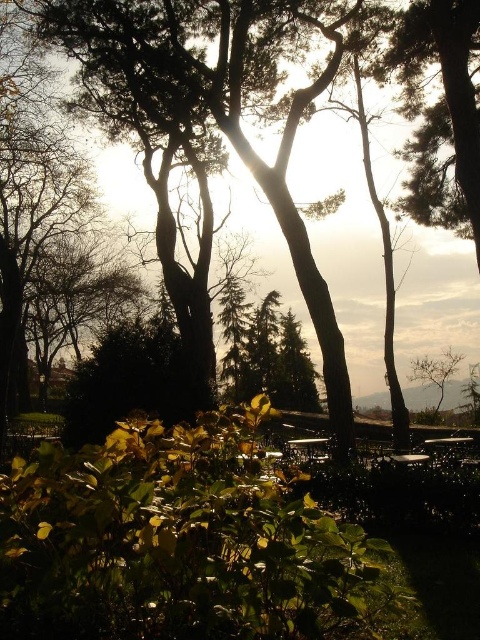
You are planning to install a small garden path between the green leafy bush at lower center and the bare branches at right. The path must be 12 meters long to accommodate all visitors. Based on the scene, will the path be long enough?

The distance between the green leafy bush at lower center and the bare branches at right is 10.78 meters. Since the required path length is 12 meters, which is longer than the existing distance, the path will not be long enough to accommodate all visitors.

You are a gardener planning to plant a new tree in the outdoor area. You notice the green leafy bush at lower center and the bare branches at right. Which object is located above the other?

The green leafy bush at lower center is positioned over the bare branches at right, meaning the bush is above the branches.